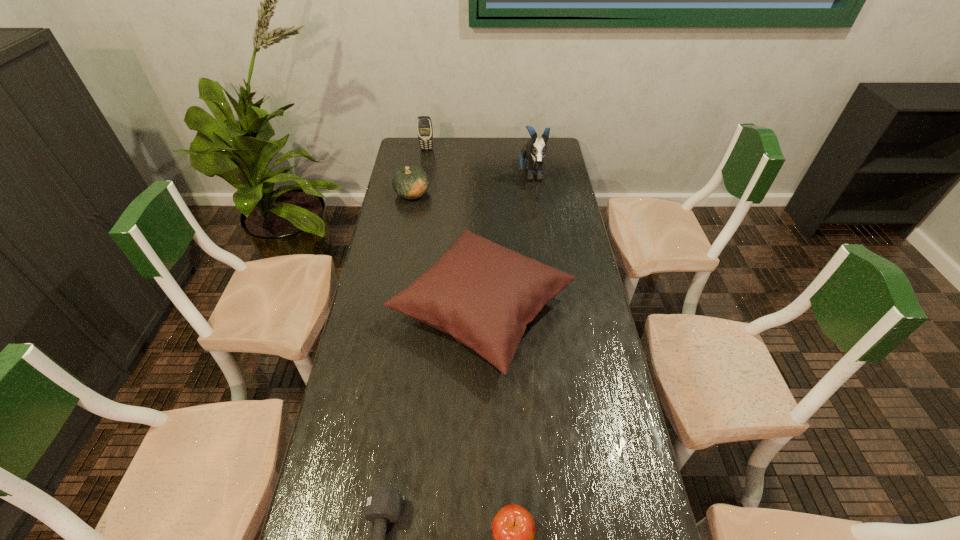
This screenshot has height=540, width=960. In order to click on puppy in this screenshot , I will do `click(535, 149)`.

Where is `the fourth farthest object`? The image size is (960, 540). the fourth farthest object is located at coordinates (483, 294).

Where is `the farthest object`? This screenshot has height=540, width=960. the farthest object is located at coordinates (424, 125).

This screenshot has height=540, width=960. What are the coordinates of `gourd` in the screenshot? It's located at (412, 182).

Identify the location of free space located 0.350m on the front-facing side of the tallest object. (540, 246).

Locate an element on the screen. Image resolution: width=960 pixels, height=540 pixels. free space located 0.160m on the back of the cushion is located at coordinates (482, 222).

You are a GUI agent. You are given a task and a screenshot of the screen. Output one action in this format:
    pyautogui.click(x=<x>, y=<y>)
    Task: Click on the free spot located on the front face of the cellular telephone
    This screenshot has width=960, height=540.
    Given the screenshot: What is the action you would take?
    pyautogui.click(x=425, y=159)

The height and width of the screenshot is (540, 960). What are the coordinates of `free space located 0.110m on the right of the fourth tallest object` in the screenshot? It's located at (456, 193).

What are the coordinates of `puppy situated at the far edge` in the screenshot? It's located at (535, 149).

What are the coordinates of `cellular telephone located at the far edge` in the screenshot? It's located at (424, 125).